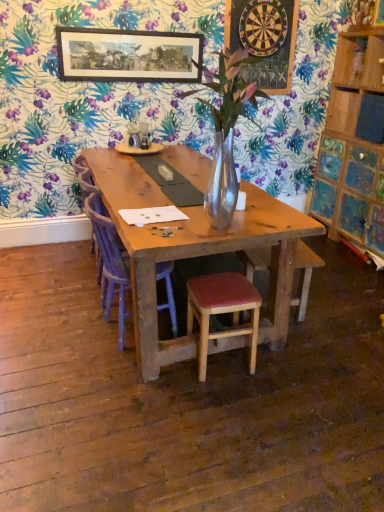
The height and width of the screenshot is (512, 384). Find the location of `wooden dartboard at upper center`. wooden dartboard at upper center is located at coordinates (264, 39).

What is the approximate height of purple wood chair at center?

It is 31.80 inches.

Measure the distance between point (203, 371) and camera.

Point (203, 371) is 2.14 meters away from camera.

Image resolution: width=384 pixels, height=512 pixels. Describe the element at coordinates (85, 177) in the screenshot. I see `purple fabric armchair at center` at that location.

Locate an element on the screen. The image size is (384, 512). wooden dartboard at upper center is located at coordinates (264, 39).

From the image's perspective, relative to purple fabric armchair at center, is wooden stool with red cushion at center above or below?

From the image's perspective, wooden stool with red cushion at center appears below purple fabric armchair at center.

Which is further, (254, 311) or (98, 264)?

The point (98, 264) is farther from the camera.

From a real-world perspective, is wooden stool with red cushion at center positioned above or below purple fabric armchair at center?

wooden stool with red cushion at center is situated lower than purple fabric armchair at center in the real world.

What's the angular difference between wooden stool with red cushion at center and purple fabric armchair at center's facing directions?

The angle between the facing direction of wooden stool with red cushion at center and the facing direction of purple fabric armchair at center is 82.6 degrees.

From the image's perspective, relative to purple wood chair at center, is wooden framed print at upper center above or below?

wooden framed print at upper center is situated higher than purple wood chair at center in the image.

Is wooden framed print at upper center bigger than purple wood chair at center?

No.

Can you confirm if wooden framed print at upper center is positioned to the right of purple wood chair at center?

No.

Is wooden framed print at upper center not inside purple wood chair at center?

wooden framed print at upper center is positioned outside purple wood chair at center.

From the image's perspective, which is below, purple wood chair at center or wooden stool with red cushion at center?

wooden stool with red cushion at center.

Is purple wood chair at center positioned far away from wooden stool with red cushion at center?

No, there isn't a large distance between purple wood chair at center and wooden stool with red cushion at center.

How distant is purple wood chair at center from wooden stool with red cushion at center?

purple wood chair at center and wooden stool with red cushion at center are 38.30 centimeters apart.

Is purple wood chair at center bigger or smaller than wooden stool with red cushion at center?

purple wood chair at center is bigger than wooden stool with red cushion at center.

Considering the positions of objects wooden stool with red cushion at center and wooden framed print at upper center in the image provided, who is more to the left, wooden stool with red cushion at center or wooden framed print at upper center?

From the viewer's perspective, wooden framed print at upper center appears more on the left side.

Between wooden stool with red cushion at center and wooden framed print at upper center, which one has larger width?

wooden stool with red cushion at center.

From a real-world perspective, who is located higher, wooden stool with red cushion at center or wooden framed print at upper center?

wooden framed print at upper center is physically above.

Who is taller, purple fabric armchair at center or wooden stool with red cushion at center?

Standing taller between the two is purple fabric armchair at center.

Looking at this image, is purple fabric armchair at center thinner than wooden stool with red cushion at center?

No, purple fabric armchair at center is not thinner than wooden stool with red cushion at center.

Is purple fabric armchair at center facing away from wooden stool with red cushion at center?

No, purple fabric armchair at center is not facing away from wooden stool with red cushion at center.

Relative to wooden stool with red cushion at center, is purple fabric armchair at center in front or behind?

purple fabric armchair at center is behind wooden stool with red cushion at center.

Measure the distance between purple fabric armchair at center and wooden framed print at upper center.

purple fabric armchair at center and wooden framed print at upper center are 1.07 meters apart.

Who is bigger, purple fabric armchair at center or wooden framed print at upper center?

With larger size is purple fabric armchair at center.

Is purple fabric armchair at center facing away from wooden framed print at upper center?

purple fabric armchair at center does not have its back to wooden framed print at upper center.

Can you confirm if purple fabric armchair at center is shorter than wooden framed print at upper center?

No.

Which object is closer to the camera taking this photo, wooden framed print at upper center or wooden stool with red cushion at center?

Positioned in front is wooden stool with red cushion at center.

Is wooden stool with red cushion at center at the back of wooden framed print at upper center?

No, wooden framed print at upper center is not facing away from wooden stool with red cushion at center.

Is point (144, 71) behind point (234, 303)?

Yes, it is.

Is wooden framed print at upper center not inside wooden stool with red cushion at center?

Absolutely, wooden framed print at upper center is external to wooden stool with red cushion at center.

This screenshot has height=512, width=384. What are the coordinates of `armchair that appears on the left of wooden stool with red cushion at center` in the screenshot? It's located at [85, 177].

Where is `picture frame that is behind the purple wood chair at center`? picture frame that is behind the purple wood chair at center is located at coordinates (128, 55).

Looking at the image, which one is located closer to wooden framed print at upper center, wooden stool with red cushion at center or wooden dartboard at upper center?

The object closer to wooden framed print at upper center is wooden dartboard at upper center.

Estimate the real-world distances between objects in this image. Which object is further from purple wood chair at center, wooden stool with red cushion at center or wooden framed print at upper center?

Based on the image, wooden framed print at upper center appears to be further to purple wood chair at center.

Looking at the image, which one is located closer to wooden dartboard at upper center, wooden framed print at upper center or purple fabric armchair at center?

Among the two, wooden framed print at upper center is located nearer to wooden dartboard at upper center.

Looking at the image, which one is located closer to purple fabric armchair at center, wooden dartboard at upper center or purple wood chair at center?

purple wood chair at center is positioned closer to the anchor purple fabric armchair at center.

From the image, which object appears to be farther from wooden dartboard at upper center, wooden framed print at upper center or wooden stool with red cushion at center?

wooden stool with red cushion at center is further to wooden dartboard at upper center.

Considering their positions, is wooden stool with red cushion at center positioned further to wooden framed print at upper center than purple wood chair at center?

Based on the image, wooden stool with red cushion at center appears to be further to wooden framed print at upper center.

Looking at the image, which one is located further to purple wood chair at center, wooden stool with red cushion at center or purple fabric armchair at center?

Among the two, wooden stool with red cushion at center is located further to purple wood chair at center.

Which object lies further to the anchor point wooden stool with red cushion at center, wooden dartboard at upper center or purple wood chair at center?

wooden dartboard at upper center lies further to wooden stool with red cushion at center than the other object.

Find the location of a particular element. Image resolution: width=384 pixels, height=512 pixels. armchair between wooden framed print at upper center and wooden stool with red cushion at center vertically is located at coordinates (85, 177).

Identify the location of armchair between wooden dartboard at upper center and wooden stool with red cushion at center vertically. (85, 177).

The height and width of the screenshot is (512, 384). Find the location of `picture frame between wooden dartboard at upper center and purple wood chair at center in the vertical direction`. picture frame between wooden dartboard at upper center and purple wood chair at center in the vertical direction is located at coordinates click(128, 55).

This screenshot has width=384, height=512. I want to click on picture frame between wooden dartboard at upper center and purple fabric armchair at center in the up-down direction, so click(x=128, y=55).